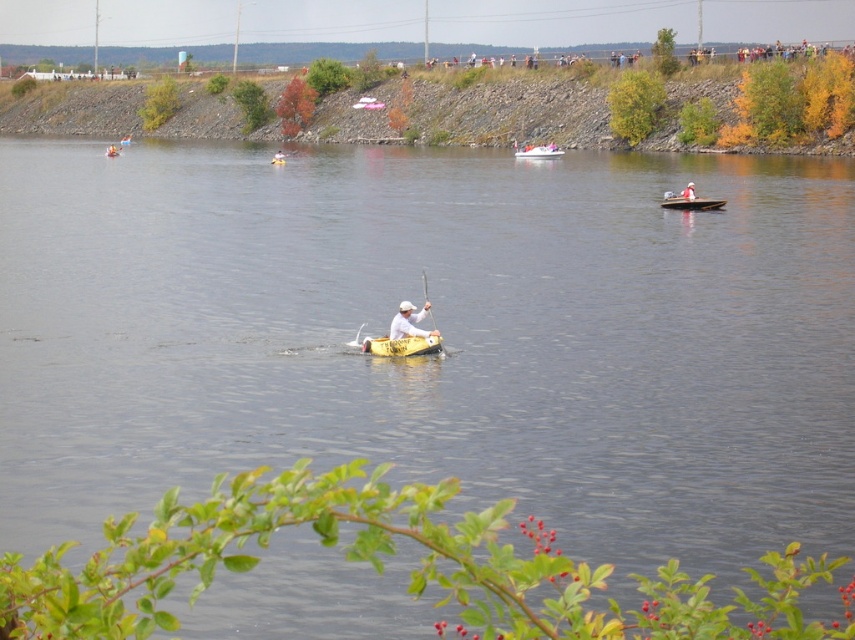
In the scene shown: You are standing at the point marked by the coordinates point (x=538, y=150). Looking around, you see a yellow plastic boat at center and other boats in the water. Which direction should you go to reach the nearest boat?

The point (x=538, y=150) marks the yellow plastic boat at center, so you are already at the boat. There is no need to move.

You are standing at the edge of the water and want to reach a specific point marked at coordinates point (540, 147). If your maximum walking distance is 90 meters, can you reach it without swimming?

The distance of point (540, 147) from camera is 92.73 meters, so you cannot reach it within your 90 meter limit without swimming.